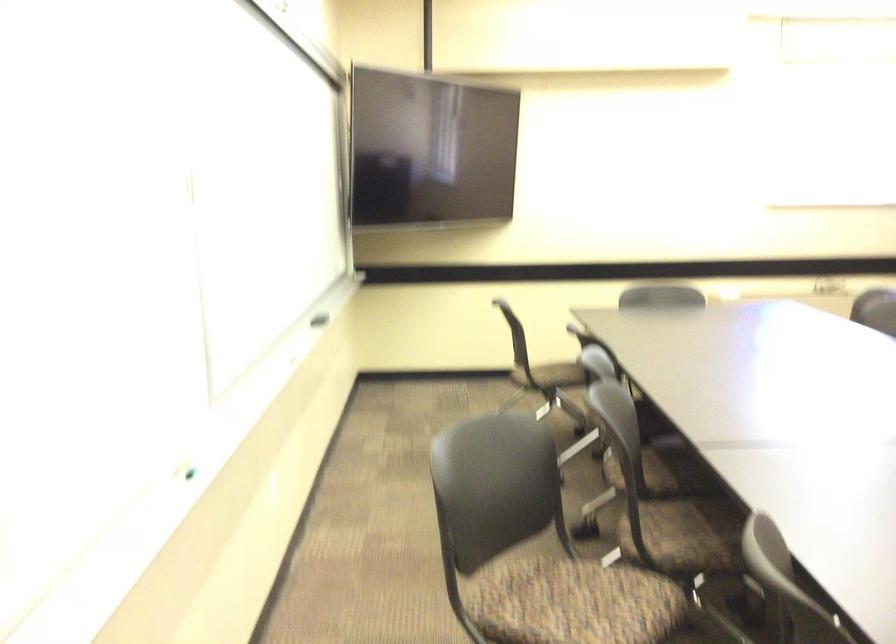
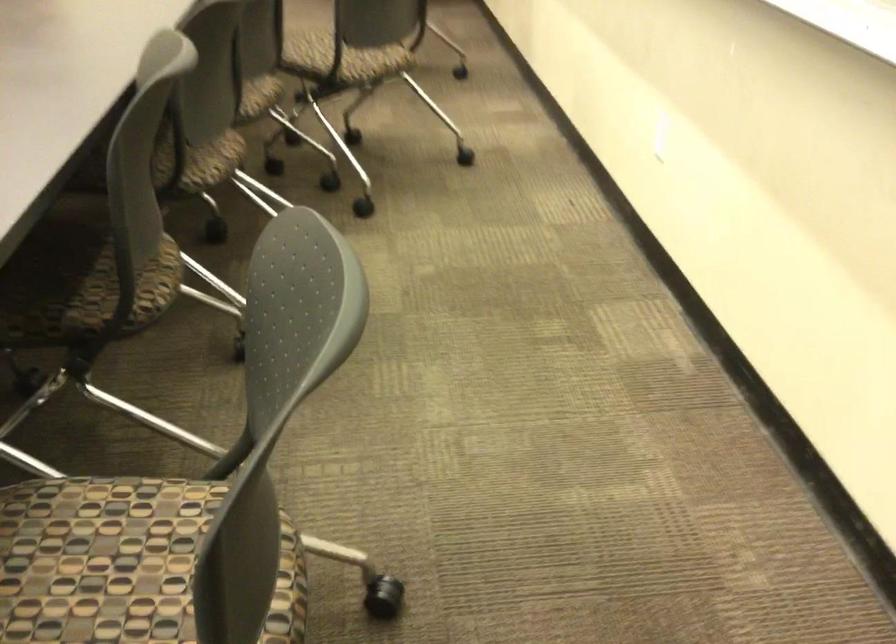
Where in the second image is the point corresponding to point (562, 362) from the first image?

(99, 556)